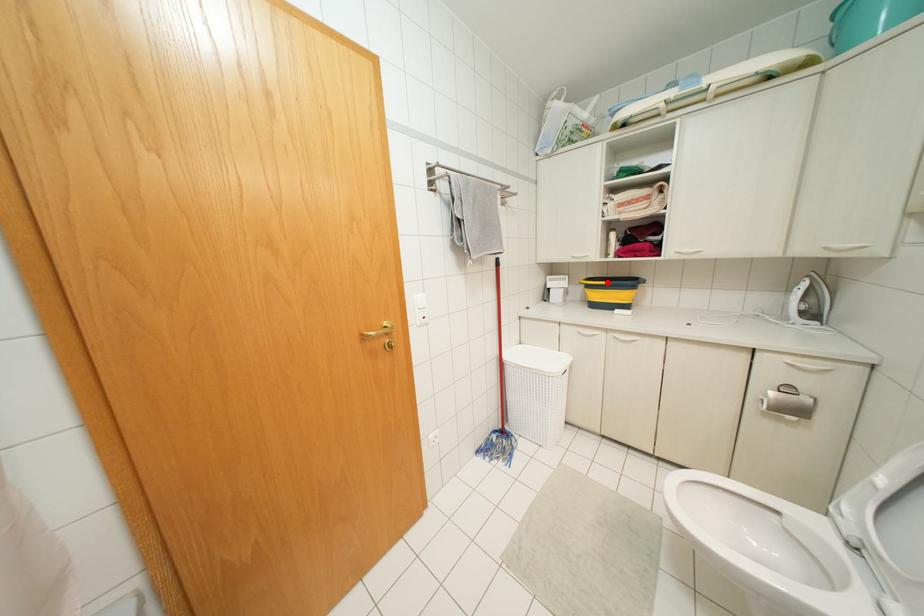
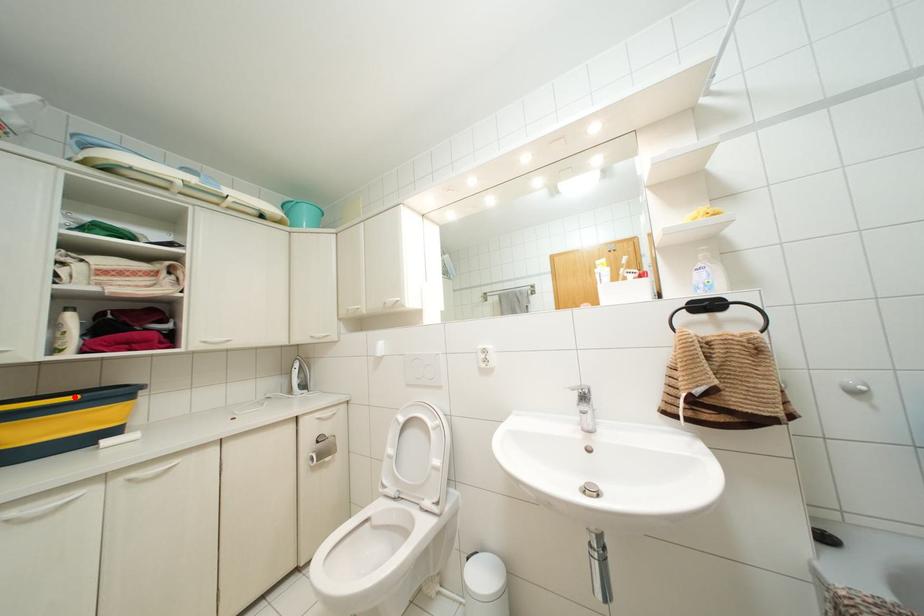
I am providing you with two images of the same scene from different viewpoints. A red point is marked on the first image and another point is marked on the second image. Do the highlighted points in image1 and image2 indicate the same real-world spot?

Yes